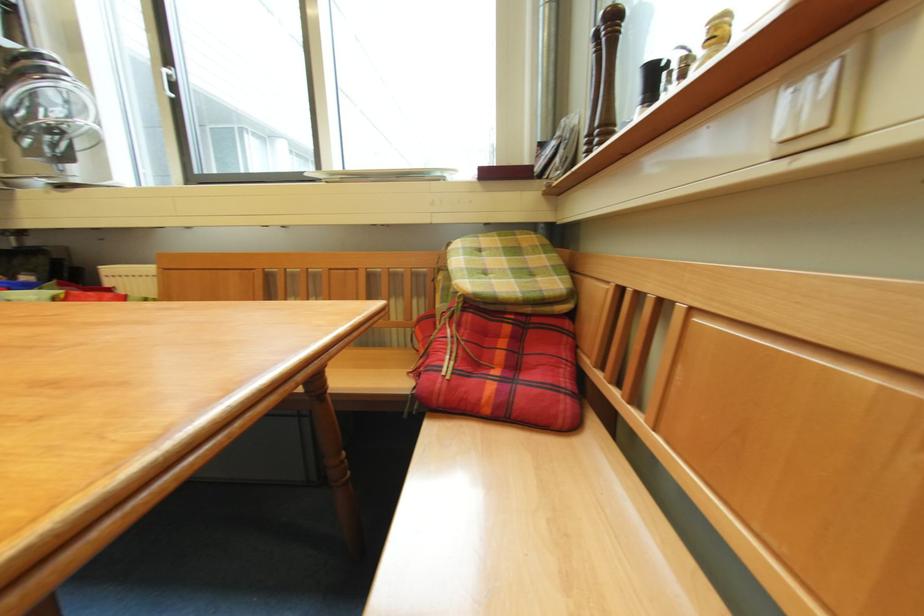
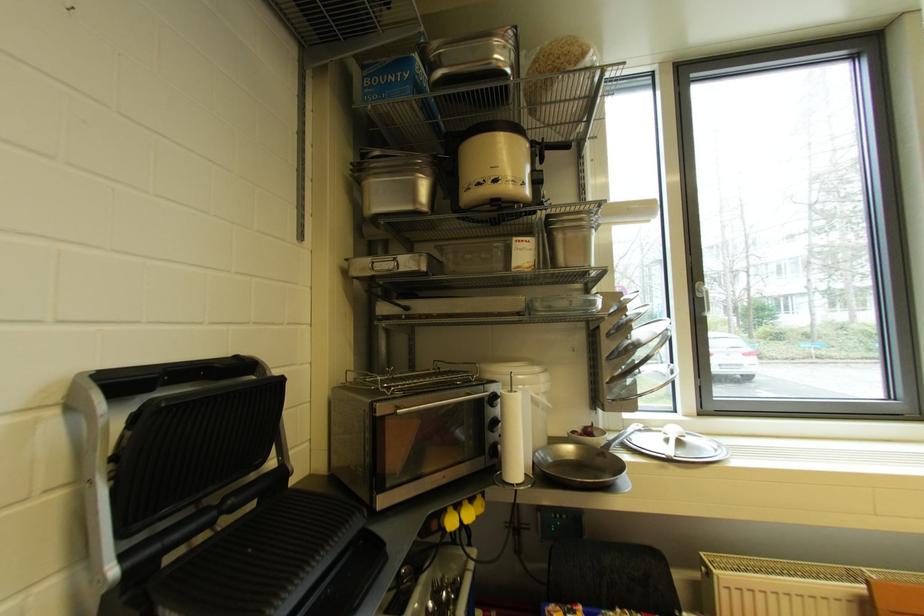
Question: The images are taken continuously from a first-person perspective. In which direction are you moving?

Choices:
 (A) Left
 (B) Right
 (C) Forward
 (D) Backward

Answer: (A)